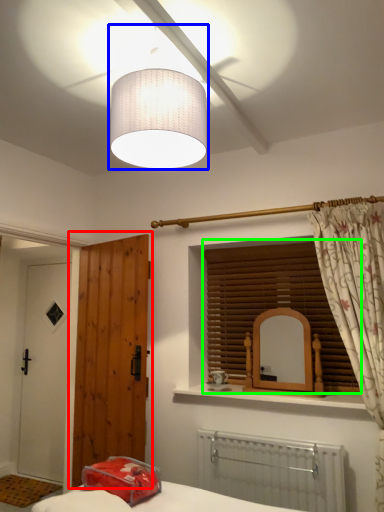
Question: Which is nearer to the door (highlighted by a red box)? lamp (highlighted by a blue box) or window blind (highlighted by a green box).

Choices:
 (A) lamp
 (B) window blind

Answer: (B)